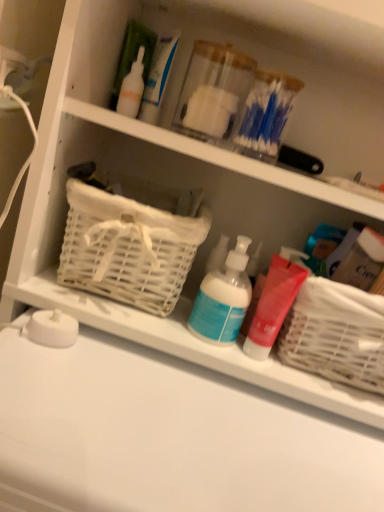
Where is `white wicker basket at left, which ranks as the first basket in left-to-right order`? The image size is (384, 512). white wicker basket at left, which ranks as the first basket in left-to-right order is located at coordinates (128, 248).

What do you see at coordinates (223, 298) in the screenshot? I see `blue matte pump bottle at center, marked as the first cleaning product in a left-to-right arrangement` at bounding box center [223, 298].

The height and width of the screenshot is (512, 384). Identify the location of matte red pump bottle at center, which ranks as the 1th cleaning product in right-to-left order. (274, 302).

At what (x,y) coordinates should I click in order to perform the action: click on white matte counter top at lower center. Please return your answer as a coordinate pair (x, y). The image size is (384, 512). Looking at the image, I should click on (167, 437).

Measure the distance between point (x=372, y=313) and camera.

20.08 inches.

I want to click on white wicker basket at left, acting as the 2th basket starting from the right, so click(128, 248).

Considering the sizes of white matte counter top at lower center and blue matte pump bottle at center, marked as the first cleaning product in a left-to-right arrangement, in the image, is white matte counter top at lower center wider or thinner than blue matte pump bottle at center, marked as the first cleaning product in a left-to-right arrangement,?

In the image, white matte counter top at lower center appears to be wider than blue matte pump bottle at center, marked as the first cleaning product in a left-to-right arrangement.

Between white matte counter top at lower center and blue matte pump bottle at center, marked as the first cleaning product in a left-to-right arrangement, which one appears on the left side from the viewer's perspective?

Positioned to the left is white matte counter top at lower center.

Is white matte counter top at lower center positioned behind blue matte pump bottle at center, marked as the first cleaning product in a left-to-right arrangement?

No, white matte counter top at lower center is closer to the viewer.

From a real-world perspective, which object stands above the other?

blue matte pump bottle at center, positioned as the second cleaning product in right-to-left order, is physically above.

From the image's perspective, is matte red pump bottle at center, which ranks as the 1th cleaning product in right-to-left order, located beneath white woven basket at right, positioned as the 2th basket in left-to-right order?

No, from the image's perspective, matte red pump bottle at center, which ranks as the 1th cleaning product in right-to-left order, is not beneath white woven basket at right, positioned as the 2th basket in left-to-right order.

How many degrees apart are the facing directions of matte red pump bottle at center, which is counted as the second cleaning product, starting from the left, and white woven basket at right, positioned as the 2th basket in left-to-right order?

They differ by 0.000894 degrees in their facing directions.

Find the location of a particular element. The width and height of the screenshot is (384, 512). the 2nd cleaning product behind the white woven basket at right, positioned as the 2th basket in left-to-right order is located at coordinates (274, 302).

Measure the distance between blue matte pump bottle at center, marked as the first cleaning product in a left-to-right arrangement, and matte red pump bottle at center, which is counted as the second cleaning product, starting from the left.

4.45 centimeters.

Can you confirm if blue matte pump bottle at center, marked as the first cleaning product in a left-to-right arrangement, is wider than matte red pump bottle at center, which is counted as the second cleaning product, starting from the left?

Yes, blue matte pump bottle at center, marked as the first cleaning product in a left-to-right arrangement, is wider than matte red pump bottle at center, which is counted as the second cleaning product, starting from the left.

From the image's perspective, is blue matte pump bottle at center, positioned as the second cleaning product in right-to-left order, above or below matte red pump bottle at center, which ranks as the 1th cleaning product in right-to-left order?

From the image's perspective, blue matte pump bottle at center, positioned as the second cleaning product in right-to-left order, appears above matte red pump bottle at center, which ranks as the 1th cleaning product in right-to-left order.

Is matte red pump bottle at center, which ranks as the 1th cleaning product in right-to-left order, to the right of white wicker basket at left, acting as the 2th basket starting from the right, from the viewer's perspective?

Indeed, matte red pump bottle at center, which ranks as the 1th cleaning product in right-to-left order, is positioned on the right side of white wicker basket at left, acting as the 2th basket starting from the right.

Consider the image. Would you say matte red pump bottle at center, which ranks as the 1th cleaning product in right-to-left order, is inside or outside white wicker basket at left, which ranks as the first basket in left-to-right order?

matte red pump bottle at center, which ranks as the 1th cleaning product in right-to-left order, is located beyond the bounds of white wicker basket at left, which ranks as the first basket in left-to-right order.

From their relative heights in the image, would you say matte red pump bottle at center, which is counted as the second cleaning product, starting from the left, is taller or shorter than white wicker basket at left, acting as the 2th basket starting from the right?

In the image, matte red pump bottle at center, which is counted as the second cleaning product, starting from the left, appears to be shorter than white wicker basket at left, acting as the 2th basket starting from the right.

Between white wicker basket at left, acting as the 2th basket starting from the right, and matte red pump bottle at center, which ranks as the 1th cleaning product in right-to-left order, which one is positioned in front?

white wicker basket at left, acting as the 2th basket starting from the right, is in front.

Are white wicker basket at left, acting as the 2th basket starting from the right, and matte red pump bottle at center, which ranks as the 1th cleaning product in right-to-left order, far apart?

That's not correct — white wicker basket at left, acting as the 2th basket starting from the right, is a little close to matte red pump bottle at center, which ranks as the 1th cleaning product in right-to-left order.

Between white wicker basket at left, acting as the 2th basket starting from the right, and matte red pump bottle at center, which is counted as the second cleaning product, starting from the left, which one has more height?

white wicker basket at left, acting as the 2th basket starting from the right, is taller.

Is white wicker basket at left, acting as the 2th basket starting from the right, bigger or smaller than matte red pump bottle at center, which is counted as the second cleaning product, starting from the left?

white wicker basket at left, acting as the 2th basket starting from the right, is bigger than matte red pump bottle at center, which is counted as the second cleaning product, starting from the left.

In the scene shown: Which object is wider, white wicker basket at left, which ranks as the first basket in left-to-right order, or white matte counter top at lower center?

Wider between the two is white matte counter top at lower center.

In the image, is white wicker basket at left, which ranks as the first basket in left-to-right order, on the left side or the right side of white matte counter top at lower center?

Based on their positions, white wicker basket at left, which ranks as the first basket in left-to-right order, is located to the left of white matte counter top at lower center.

Is point (199, 234) closer or farther from the camera than point (352, 462)?

Point (199, 234) is farther from the camera than point (352, 462).

From the image's perspective, is white wicker basket at left, acting as the 2th basket starting from the right, positioned above or below white matte counter top at lower center?

white wicker basket at left, acting as the 2th basket starting from the right, is above white matte counter top at lower center.

Which object is closer to the camera taking this photo, white woven basket at right, positioned as the 2th basket in left-to-right order, or white wicker basket at left, acting as the 2th basket starting from the right?

Positioned in front is white woven basket at right, positioned as the 2th basket in left-to-right order.

Is white woven basket at right, positioned as the 2th basket in left-to-right order, to the right of white wicker basket at left, which ranks as the first basket in left-to-right order, from the viewer's perspective?

Correct, you'll find white woven basket at right, positioned as the 2th basket in left-to-right order, to the right of white wicker basket at left, which ranks as the first basket in left-to-right order.

Considering the sizes of objects white woven basket at right, positioned as the 2th basket in left-to-right order, and white wicker basket at left, acting as the 2th basket starting from the right, in the image provided, who is shorter, white woven basket at right, positioned as the 2th basket in left-to-right order, or white wicker basket at left, acting as the 2th basket starting from the right,?

Standing shorter between the two is white woven basket at right, positioned as the 2th basket in left-to-right order.

Looking at this image, are white woven basket at right, arranged as the first basket when viewed from the right, and white wicker basket at left, acting as the 2th basket starting from the right, located far from each other?

Actually, white woven basket at right, arranged as the first basket when viewed from the right, and white wicker basket at left, acting as the 2th basket starting from the right, are a little close together.

At what (x,y) coordinates should I click in order to perform the action: click on the 1st cleaning product behind the white matte counter top at lower center, counting from the anchor's position. Please return your answer as a coordinate pair (x, y). The image size is (384, 512). Looking at the image, I should click on (223, 298).

From a real-world perspective, count 2nd cleaning products upward from the white woven basket at right, positioned as the 2th basket in left-to-right order, and point to it. Please provide its 2D coordinates.

[(274, 302)]

Looking at the image, which one is located further to matte red pump bottle at center, which ranks as the 1th cleaning product in right-to-left order, white matte counter top at lower center or white wicker basket at left, acting as the 2th basket starting from the right?

The object further to matte red pump bottle at center, which ranks as the 1th cleaning product in right-to-left order, is white matte counter top at lower center.

Which object lies further to the anchor point white wicker basket at left, acting as the 2th basket starting from the right, white woven basket at right, positioned as the 2th basket in left-to-right order, or blue matte pump bottle at center, marked as the first cleaning product in a left-to-right arrangement?

white woven basket at right, positioned as the 2th basket in left-to-right order, lies further to white wicker basket at left, acting as the 2th basket starting from the right, than the other object.

In the scene shown: Looking at the image, which one is located further to blue matte pump bottle at center, marked as the first cleaning product in a left-to-right arrangement, white matte counter top at lower center or white wicker basket at left, acting as the 2th basket starting from the right?

Based on the image, white matte counter top at lower center appears to be further to blue matte pump bottle at center, marked as the first cleaning product in a left-to-right arrangement.

From the image, which object appears to be nearer to matte red pump bottle at center, which ranks as the 1th cleaning product in right-to-left order, white wicker basket at left, which ranks as the first basket in left-to-right order, or white matte counter top at lower center?

The object closer to matte red pump bottle at center, which ranks as the 1th cleaning product in right-to-left order, is white wicker basket at left, which ranks as the first basket in left-to-right order.

Based on their spatial positions, is matte red pump bottle at center, which is counted as the second cleaning product, starting from the left, or white woven basket at right, positioned as the 2th basket in left-to-right order, closer to blue matte pump bottle at center, positioned as the second cleaning product in right-to-left order?

The object closer to blue matte pump bottle at center, positioned as the second cleaning product in right-to-left order, is matte red pump bottle at center, which is counted as the second cleaning product, starting from the left.

Considering their positions, is blue matte pump bottle at center, positioned as the second cleaning product in right-to-left order, positioned closer to matte red pump bottle at center, which is counted as the second cleaning product, starting from the left, than white wicker basket at left, acting as the 2th basket starting from the right?

blue matte pump bottle at center, positioned as the second cleaning product in right-to-left order, is positioned closer to the anchor matte red pump bottle at center, which is counted as the second cleaning product, starting from the left.

Looking at the image, which one is located further to matte red pump bottle at center, which ranks as the 1th cleaning product in right-to-left order, white woven basket at right, arranged as the first basket when viewed from the right, or blue matte pump bottle at center, positioned as the second cleaning product in right-to-left order?

white woven basket at right, arranged as the first basket when viewed from the right, is further to matte red pump bottle at center, which ranks as the 1th cleaning product in right-to-left order.

Considering their positions, is matte red pump bottle at center, which ranks as the 1th cleaning product in right-to-left order, positioned further to white matte counter top at lower center than white woven basket at right, arranged as the first basket when viewed from the right?

white woven basket at right, arranged as the first basket when viewed from the right, lies further to white matte counter top at lower center than the other object.

Locate an element on the screen. This screenshot has height=512, width=384. basket between blue matte pump bottle at center, positioned as the second cleaning product in right-to-left order, and white matte counter top at lower center, in the vertical direction is located at coordinates (336, 334).

Where is `cleaning product between blue matte pump bottle at center, positioned as the second cleaning product in right-to-left order, and white matte counter top at lower center, in the vertical direction`? This screenshot has width=384, height=512. cleaning product between blue matte pump bottle at center, positioned as the second cleaning product in right-to-left order, and white matte counter top at lower center, in the vertical direction is located at coordinates (274, 302).

This screenshot has width=384, height=512. I want to click on basket between matte red pump bottle at center, which ranks as the 1th cleaning product in right-to-left order, and white matte counter top at lower center, in the vertical direction, so click(336, 334).

The image size is (384, 512). Find the location of `basket that lies between white wicker basket at left, acting as the 2th basket starting from the right, and white matte counter top at lower center from top to bottom`. basket that lies between white wicker basket at left, acting as the 2th basket starting from the right, and white matte counter top at lower center from top to bottom is located at coordinates (336, 334).